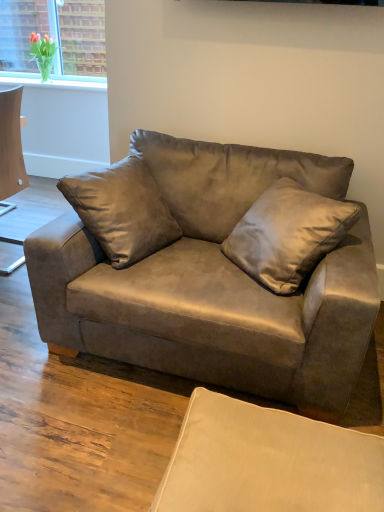
Measure the distance between point (292, 389) and camera.

Point (292, 389) is 1.56 meters away from camera.

What do you see at coordinates (268, 462) in the screenshot? This screenshot has height=512, width=384. I see `beige fabric swivel chair at lower right` at bounding box center [268, 462].

The image size is (384, 512). What do you see at coordinates (287, 234) in the screenshot?
I see `satin brown pillow at center` at bounding box center [287, 234].

Locate an element on the screen. suede couch at center is located at coordinates (214, 283).

From a real-world perspective, between suede couch at center and beige fabric swivel chair at lower right, who is vertically higher?

suede couch at center is physically above.

Is suede couch at center with beige fabric swivel chair at lower right?

No, suede couch at center is not beside beige fabric swivel chair at lower right.

Is point (143, 265) in front of point (199, 425)?

No.

Is suede couch at center in front of or behind beige fabric swivel chair at lower right in the image?

suede couch at center is behind beige fabric swivel chair at lower right.

Does point (160, 189) come in front of point (275, 279)?

No, it is behind (275, 279).

Locate an element on the screen. pillow located above the suede couch at center (from a real-world perspective) is located at coordinates (287, 234).

Is suede couch at center spatially inside satin brown pillow at center, or outside of it?

suede couch at center is located beyond the bounds of satin brown pillow at center.

Is suede couch at center wider or thinner than satin brown pillow at center?

suede couch at center is wider than satin brown pillow at center.

In the scene shown: Does beige fabric swivel chair at lower right have a greater height compared to satin brown pillow at center?

No.

Consider the image. Is beige fabric swivel chair at lower right directly adjacent to satin brown pillow at center?

They are not placed beside each other.

From the image's perspective, is satin brown pillow at center on top of beige fabric swivel chair at lower right?

Yes.

Image resolution: width=384 pixels, height=512 pixels. What are the coordinates of `pillow above the beige fabric swivel chair at lower right (from a real-world perspective)` in the screenshot? It's located at (287, 234).

Is satin brown pillow at center taller or shorter than beige fabric swivel chair at lower right?

Clearly, satin brown pillow at center is taller compared to beige fabric swivel chair at lower right.

From the image's perspective, which object appears higher, satin brown pillow at center or suede couch at center?

satin brown pillow at center, from the image's perspective.

Looking at their sizes, would you say satin brown pillow at center is wider or thinner than suede couch at center?

In the image, satin brown pillow at center appears to be more narrow than suede couch at center.

Would you consider satin brown pillow at center to be distant from suede couch at center?

They are positioned close to each other.

Does satin brown pillow at center have a smaller size compared to suede couch at center?

Yes, satin brown pillow at center is smaller than suede couch at center.

Is beige fabric swivel chair at lower right with suede couch at center?

No, beige fabric swivel chair at lower right is not with suede couch at center.

At what (x,y) coordinates should I click in order to perform the action: click on swivel chair that appears below the suede couch at center (from a real-world perspective). Please return your answer as a coordinate pair (x, y). Looking at the image, I should click on (268, 462).

From a real-world perspective, between beige fabric swivel chair at lower right and suede couch at center, who is vertically lower?

From a 3D spatial view, beige fabric swivel chair at lower right is below.

Which object is positioned more to the right, beige fabric swivel chair at lower right or suede couch at center?

beige fabric swivel chair at lower right is more to the right.

In the image, there is a suede couch at center. Where is `swivel chair below it (from the image's perspective)`? Image resolution: width=384 pixels, height=512 pixels. swivel chair below it (from the image's perspective) is located at coordinates (268, 462).

What are the coordinates of `studio couch that appears below the satin brown pillow at center (from a real-world perspective)` in the screenshot? It's located at (214, 283).

Estimate the real-world distances between objects in this image. Which object is further from satin brown pillow at center, beige fabric swivel chair at lower right or suede couch at center?

beige fabric swivel chair at lower right.

Considering their positions, is suede couch at center positioned further to beige fabric swivel chair at lower right than satin brown pillow at center?

satin brown pillow at center.

Estimate the real-world distances between objects in this image. Which object is closer to suede couch at center, beige fabric swivel chair at lower right or satin brown pillow at center?

Among the two, satin brown pillow at center is located nearer to suede couch at center.

Considering their positions, is suede couch at center positioned further to satin brown pillow at center than beige fabric swivel chair at lower right?

beige fabric swivel chair at lower right lies further to satin brown pillow at center than the other object.

When comparing their distances from suede couch at center, does satin brown pillow at center or beige fabric swivel chair at lower right seem further?

The object further to suede couch at center is beige fabric swivel chair at lower right.

Considering their positions, is satin brown pillow at center positioned closer to beige fabric swivel chair at lower right than suede couch at center?

suede couch at center.

Where is `studio couch that lies between satin brown pillow at center and beige fabric swivel chair at lower right from top to bottom`? Image resolution: width=384 pixels, height=512 pixels. studio couch that lies between satin brown pillow at center and beige fabric swivel chair at lower right from top to bottom is located at coordinates (214, 283).